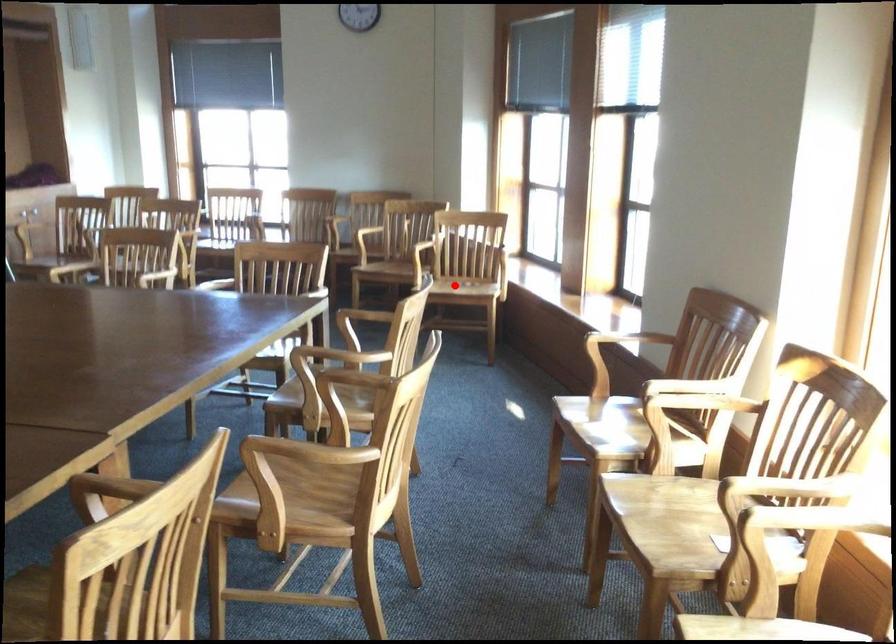
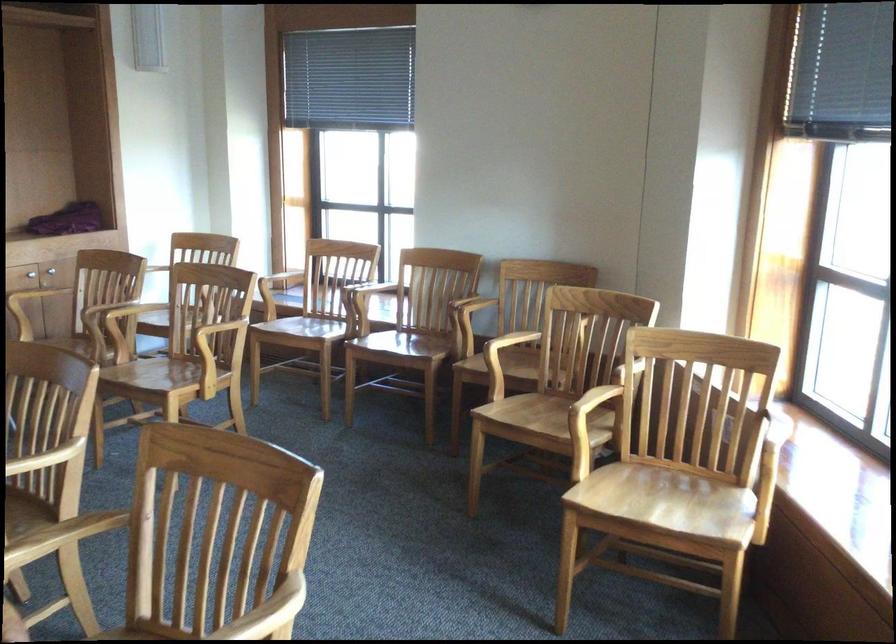
Question: I am providing you with two images of the same scene from different viewpoints. A red point is marked on the first image. Is the red point's position out of view in image 2?

Choices:
 (A) Yes
 (B) No

Answer: (B)